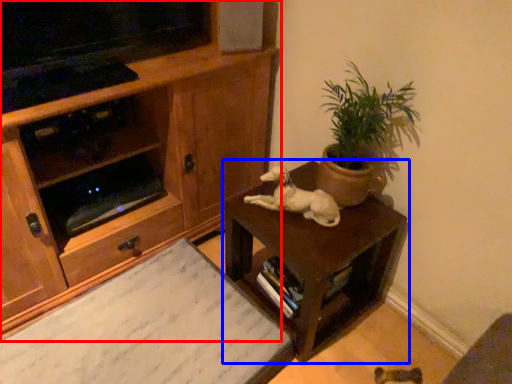
Question: Which object is further to the camera taking this photo, cabinetry (highlighted by a red box) or table (highlighted by a blue box)?

Choices:
 (A) cabinetry
 (B) table

Answer: (B)